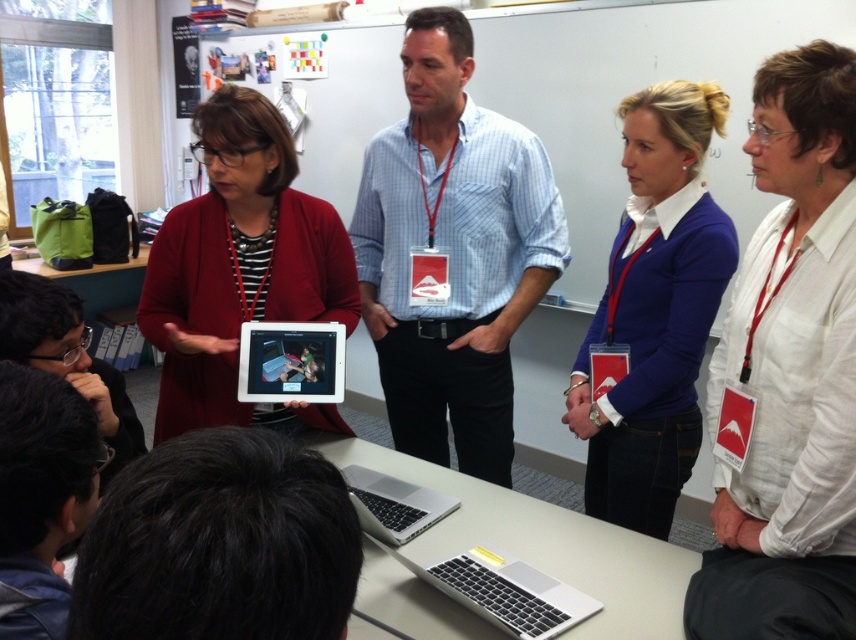
You are a photographer trying to capture a group photo of the white linen shirt at upper right and the matte purple sweater at upper right. The camera you are using has a minimum focus distance of 12 inches. Can you take a clear photo of both subjects without moving them?

The white linen shirt at upper right is 12.94 inches from the matte purple sweater at upper right. Since the distance between them is greater than the camera minimum focus distance of 12 inches, you can take a clear photo of both subjects without moving them.

You are standing at the camera position and want to reach point (771, 317). Can you walk straight to it without needing to move around any obstacles?

The distance between you and point (771, 317) is 1.22 meters, so yes, you can walk straight to it without needing to move around any obstacles.